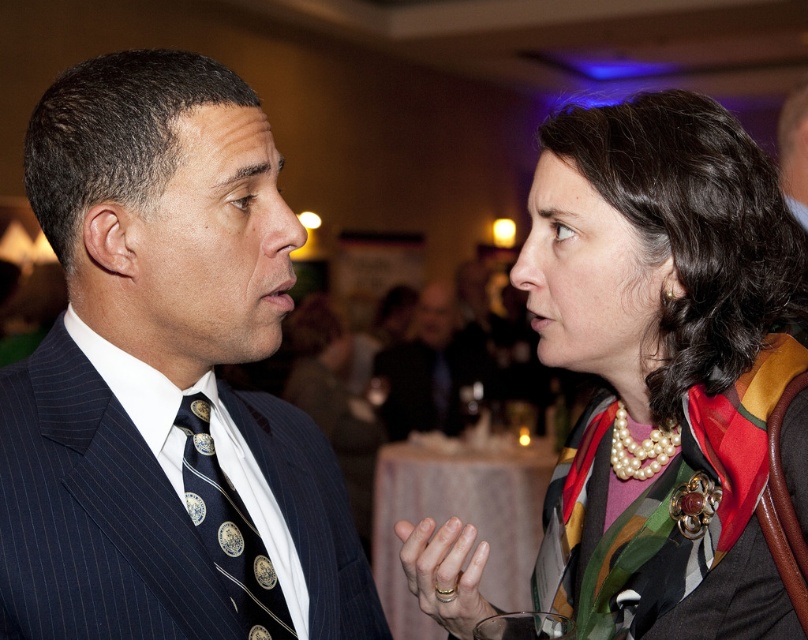
Question: Which object is closer to the camera taking this photo?

Choices:
 (A) navy silk tie at center
 (B) pearl necklace at upper right
 (C) dark blue pinstripe suit at center
 (D) dark suit at center

Answer: (C)

Question: Which of these objects is positioned farthest from the navy silk tie at center?

Choices:
 (A) dark suit at center
 (B) pearl necklace at upper right
 (C) dark blue pinstripe suit at center

Answer: (A)

Question: Observing the image, what is the correct spatial positioning of dark blue pinstripe suit at center in reference to dark suit at center?

Choices:
 (A) above
 (B) below

Answer: (A)

Question: Can you confirm if dark blue pinstripe suit at center is smaller than navy silk tie at center?

Choices:
 (A) yes
 (B) no

Answer: (B)

Question: Is dark blue pinstripe suit at center behind dark suit at center?

Choices:
 (A) yes
 (B) no

Answer: (B)

Question: Which point is farther from the camera taking this photo?

Choices:
 (A) (217, 515)
 (B) (142, 435)

Answer: (A)